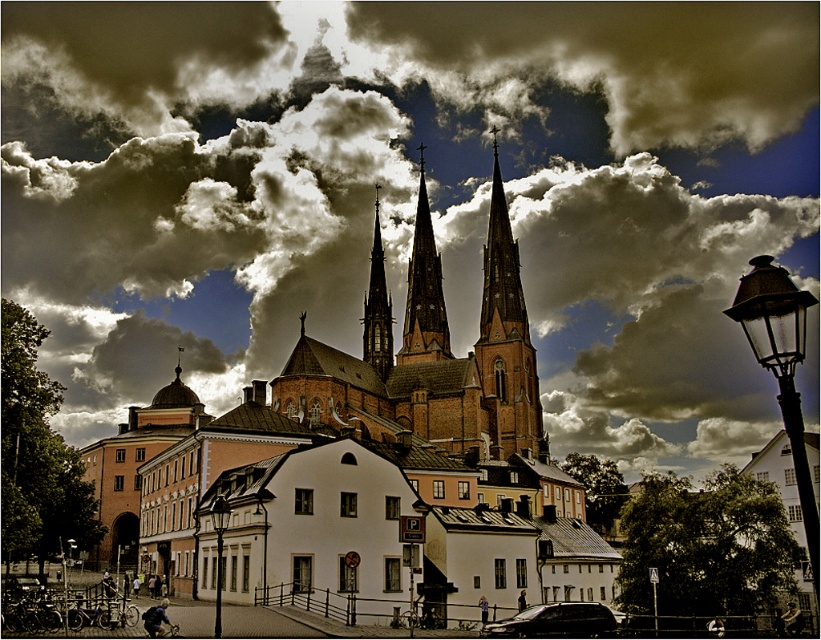
Question: Does dark cloudy sky at upper center appear on the right side of smooth stone spire at center?

Choices:
 (A) yes
 (B) no

Answer: (B)

Question: Which point is closer to the camera taking this photo?

Choices:
 (A) (304, 269)
 (B) (374, 236)
 (C) (746, 291)

Answer: (C)

Question: Considering the relative positions of matte black lamp post at right and smooth stone spire at center in the image provided, where is matte black lamp post at right located with respect to smooth stone spire at center?

Choices:
 (A) above
 (B) below

Answer: (B)

Question: Which point appears farthest from the camera in this image?

Choices:
 (A) (523, 452)
 (B) (416, 285)
 (C) (627, 157)

Answer: (C)

Question: Which point is closer to the camera?

Choices:
 (A) (781, 326)
 (B) (425, 301)

Answer: (A)

Question: Is matte black lamp post at right to the left of black glass streetlight at lower left from the viewer's perspective?

Choices:
 (A) yes
 (B) no

Answer: (B)